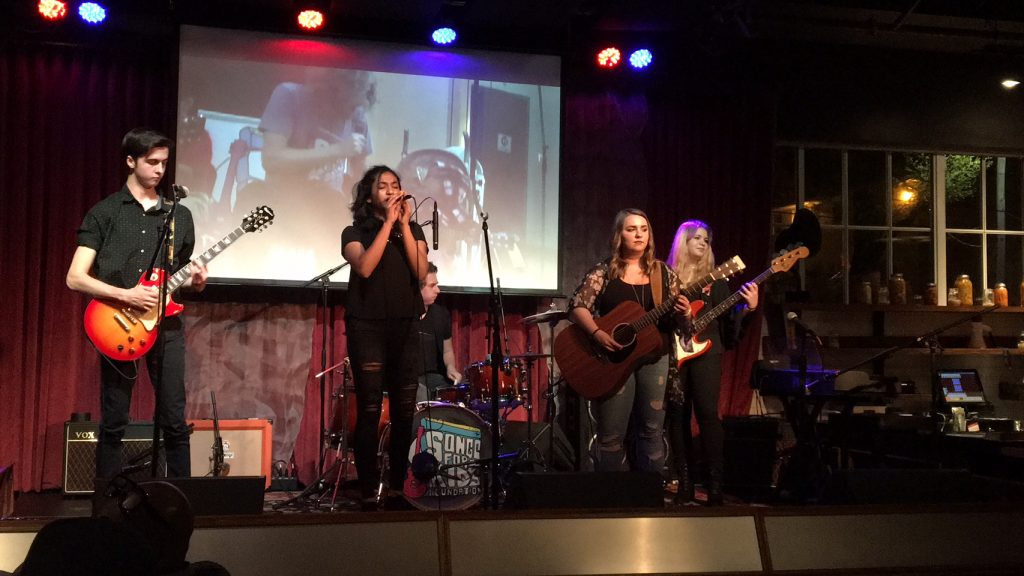
You are a GUI agent. You are given a task and a screenshot of the screen. Output one action in this format:
    pyautogui.click(x=<x>, y=<y>)
    Task: Click on the windows
    The width and height of the screenshot is (1024, 576).
    Given the screenshot: What is the action you would take?
    pyautogui.click(x=830, y=190), pyautogui.click(x=871, y=185), pyautogui.click(x=908, y=185), pyautogui.click(x=968, y=196), pyautogui.click(x=1012, y=204), pyautogui.click(x=990, y=263), pyautogui.click(x=959, y=260), pyautogui.click(x=908, y=267), pyautogui.click(x=867, y=257), pyautogui.click(x=833, y=263)